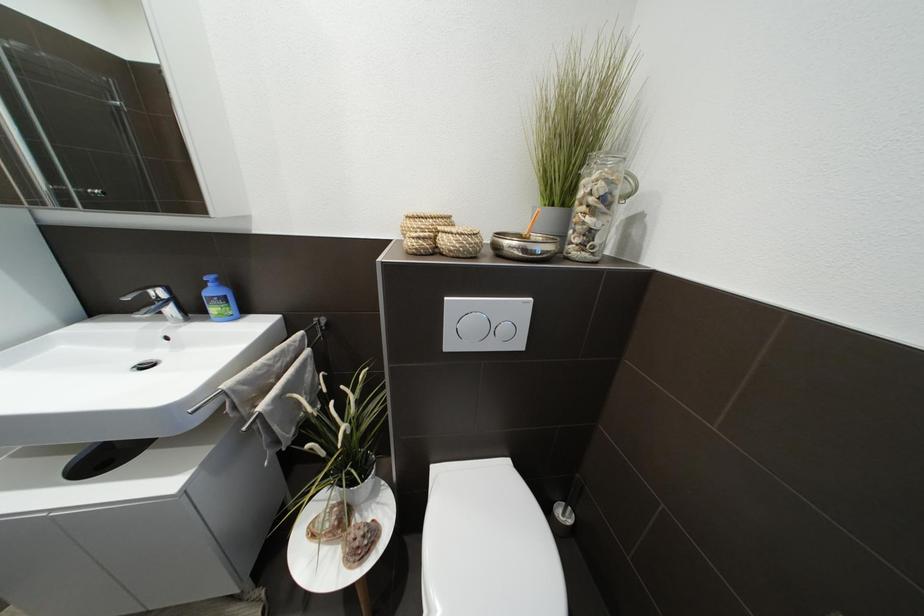
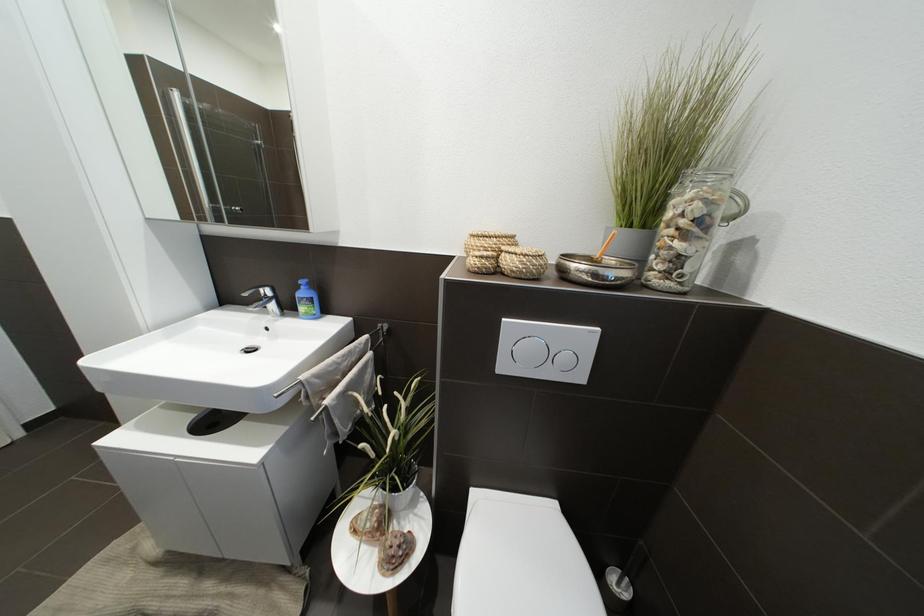
Which direction would the cameraman need to move to produce the second image?

The cameraman walked toward left, forward.